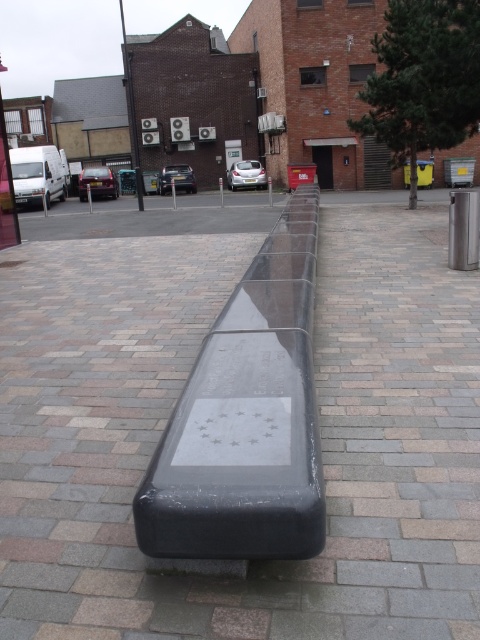
Question: Can you confirm if black polished bench at center is thinner than black polished stone bench at center?

Choices:
 (A) yes
 (B) no

Answer: (B)

Question: From the image, what is the correct spatial relationship of black polished bench at center in relation to black polished stone bench at center?

Choices:
 (A) right
 (B) left

Answer: (B)

Question: Among these points, which one is nearest to the camera?

Choices:
 (A) (165, 449)
 (B) (98, 301)

Answer: (A)

Question: Which point is closer to the camera?

Choices:
 (A) black polished stone bench at center
 (B) black polished bench at center

Answer: (B)

Question: Is black polished bench at center thinner than black polished stone bench at center?

Choices:
 (A) no
 (B) yes

Answer: (A)